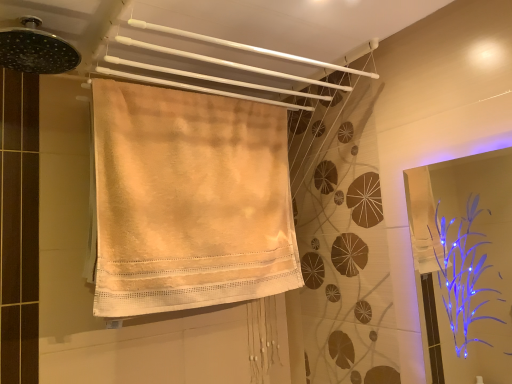
Question: Considering the positions of transparent plastic screen door at right and beige cotton towel at upper center, which is the second towel in bottom-to-top order, in the image, is transparent plastic screen door at right bigger or smaller than beige cotton towel at upper center, which is the second towel in bottom-to-top order,?

Choices:
 (A) small
 (B) big

Answer: (A)

Question: Is transparent plastic screen door at right in front of or behind beige cotton towel at upper center, which is the second towel in bottom-to-top order, in the image?

Choices:
 (A) front
 (B) behind

Answer: (B)

Question: Estimate the real-world distances between objects in this image. Which object is closer to the beige cotton towel at center, marked as the 1th towel in a bottom-to-top arrangement?

Choices:
 (A) beige cotton towel at upper center, positioned as the 1th towel in top-to-bottom order
 (B) transparent plastic screen door at right
 (C) black metallic shower head at upper left

Answer: (A)

Question: Estimate the real-world distances between objects in this image. Which object is closer to the beige cotton towel at upper center, positioned as the 1th towel in top-to-bottom order?

Choices:
 (A) black metallic shower head at upper left
 (B) transparent plastic screen door at right
 (C) beige cotton towel at center, marked as the 1th towel in a bottom-to-top arrangement

Answer: (C)